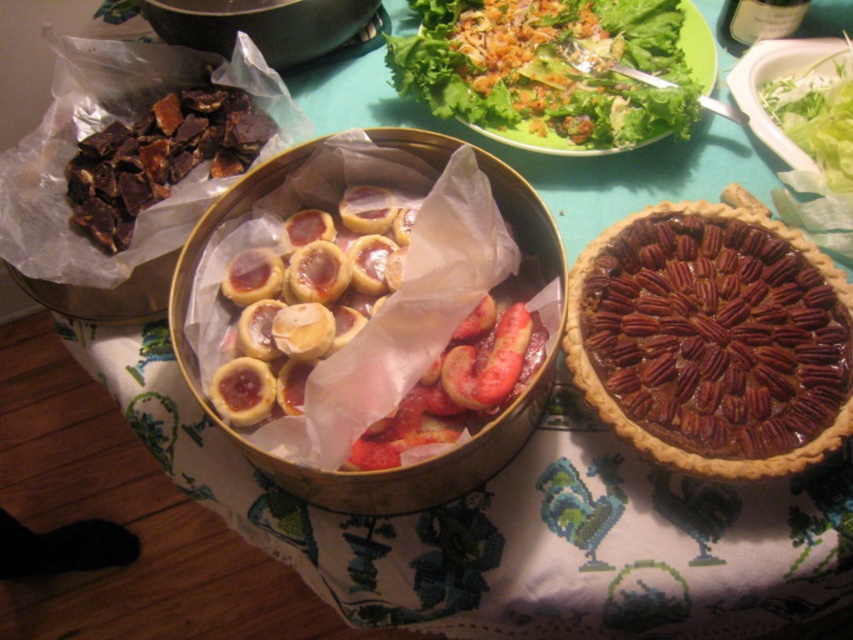
Who is positioned more to the right, brown crumbly pie at center right or green leafy salad at upper center?

brown crumbly pie at center right

Identify the location of brown crumbly pie at center right. (712, 340).

The width and height of the screenshot is (853, 640). I want to click on brown crumbly pie at center right, so click(712, 340).

Is green leafy salad at upper center to the right of shiny brown pie at center from the viewer's perspective?

Indeed, green leafy salad at upper center is positioned on the right side of shiny brown pie at center.

Can you confirm if green leafy salad at upper center is thinner than shiny brown pie at center?

No, green leafy salad at upper center is not thinner than shiny brown pie at center.

Does point (447, 40) lie behind point (439, 476)?

Yes, point (447, 40) is farther from viewer.

This screenshot has height=640, width=853. Identify the location of green leafy salad at upper center. (555, 68).

Which is more to the left, brown crumbly pie at center right or shiny brown pie at center?

shiny brown pie at center

The width and height of the screenshot is (853, 640). Identify the location of brown crumbly pie at center right. (712, 340).

Does point (836, 316) lie behind point (171, 317)?

Yes, it is.

This screenshot has width=853, height=640. I want to click on brown crumbly pie at center right, so click(712, 340).